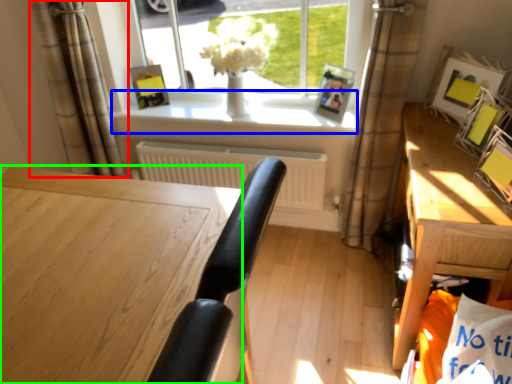
Question: Based on their relative distances, which object is farther from curtain (highlighted by a red box)? Choose from window sill (highlighted by a blue box) and desk (highlighted by a green box).

Choices:
 (A) window sill
 (B) desk

Answer: (B)